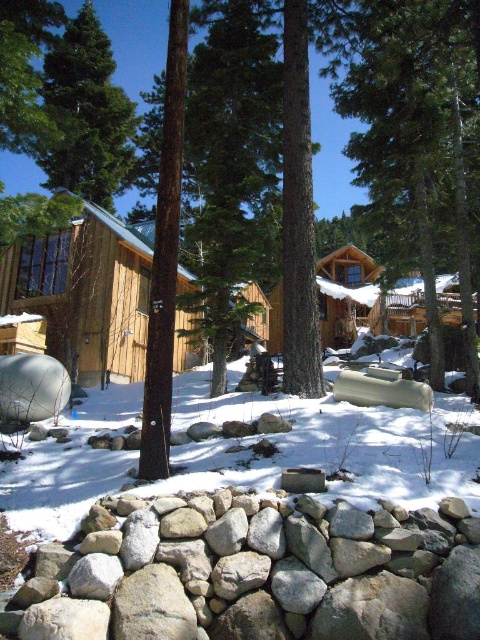
Who is shorter, brown wood tree at center or green matte tree at upper left?

Standing shorter between the two is brown wood tree at center.

Between brown wood tree at center and green matte tree at upper left, which one appears on the left side from the viewer's perspective?

green matte tree at upper left

This screenshot has width=480, height=640. What do you see at coordinates (415, 140) in the screenshot?
I see `brown wood tree at center` at bounding box center [415, 140].

Find the location of a particular element. Image resolution: width=480 pixels, height=640 pixels. brown wood tree at center is located at coordinates (415, 140).

Is wooden cabin at center shorter than green matte tree at upper left?

Yes.

The width and height of the screenshot is (480, 640). What do you see at coordinates (113, 300) in the screenshot?
I see `wooden cabin at center` at bounding box center [113, 300].

At what (x,y) coordinates should I click in order to perform the action: click on wooden cabin at center. Please return your answer as a coordinate pair (x, y). This screenshot has height=640, width=480. Looking at the image, I should click on (113, 300).

Who is lower down, gray rock wall at lower center or wooden cabin at center?

gray rock wall at lower center

Between gray rock wall at lower center and wooden cabin at center, which one appears on the right side from the viewer's perspective?

gray rock wall at lower center is more to the right.

Image resolution: width=480 pixels, height=640 pixels. I want to click on gray rock wall at lower center, so (x=256, y=573).